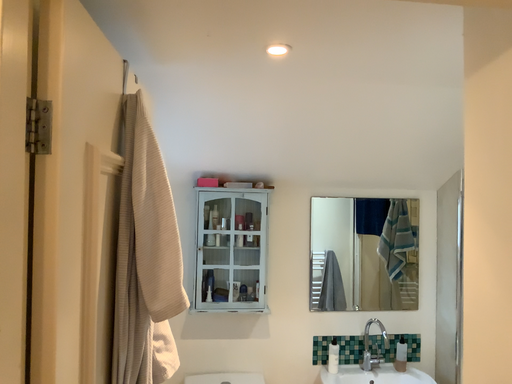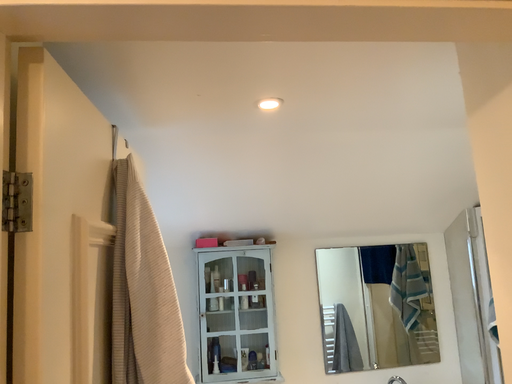
Question: How did the camera likely rotate when shooting the video?

Choices:
 (A) rotated upward
 (B) rotated downward

Answer: (A)